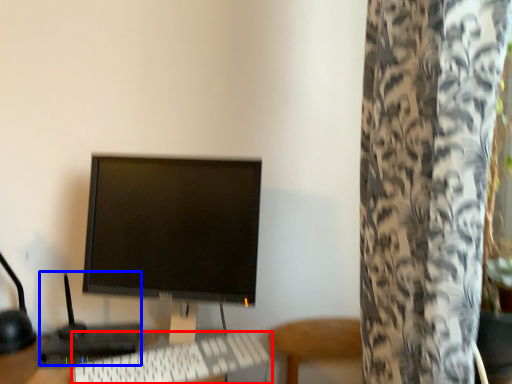
Question: Among these objects, which one is farthest to the camera, computer keyboard (highlighted by a red box) or computer (highlighted by a blue box)?

Choices:
 (A) computer keyboard
 (B) computer

Answer: (B)